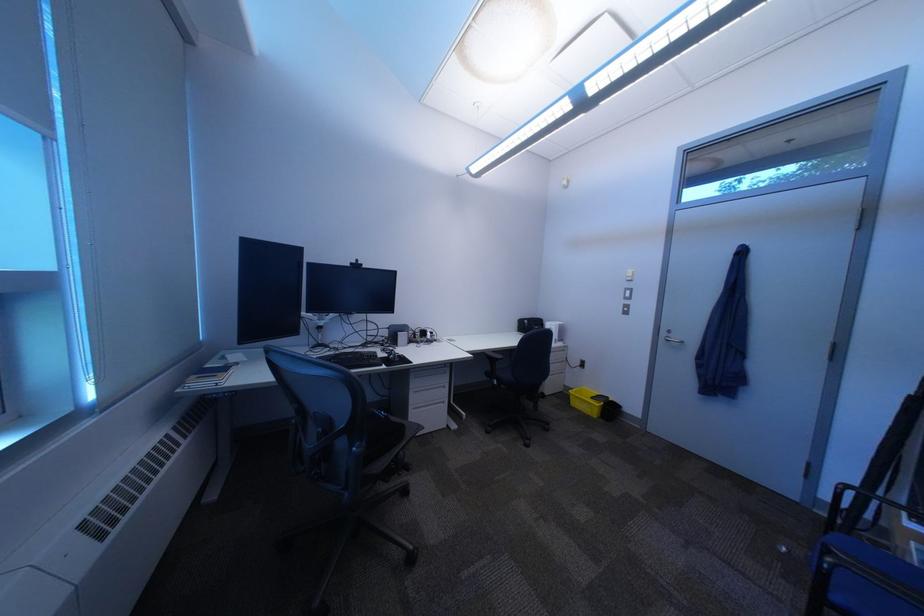
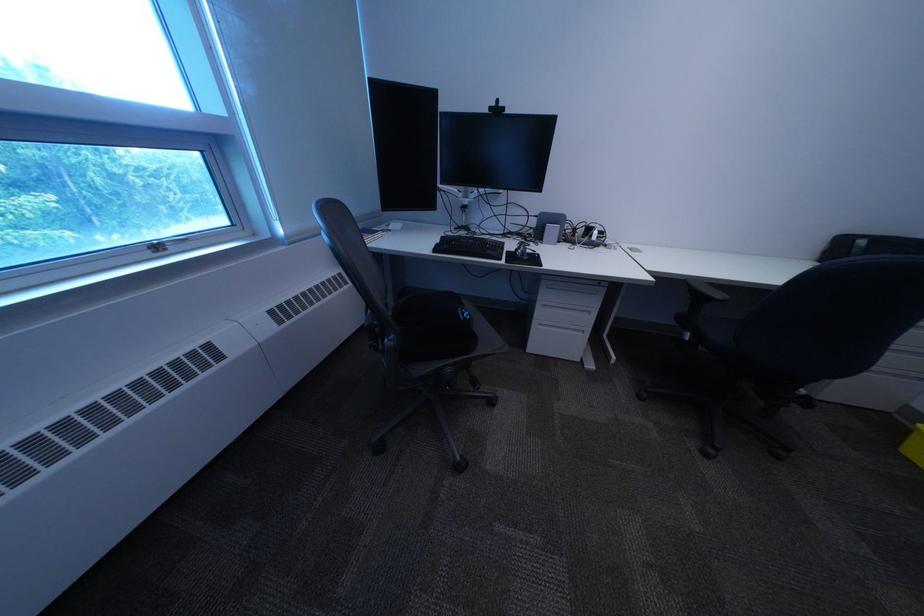
Where in the second image is the point corresponding to (372,446) from the first image?

(407, 338)